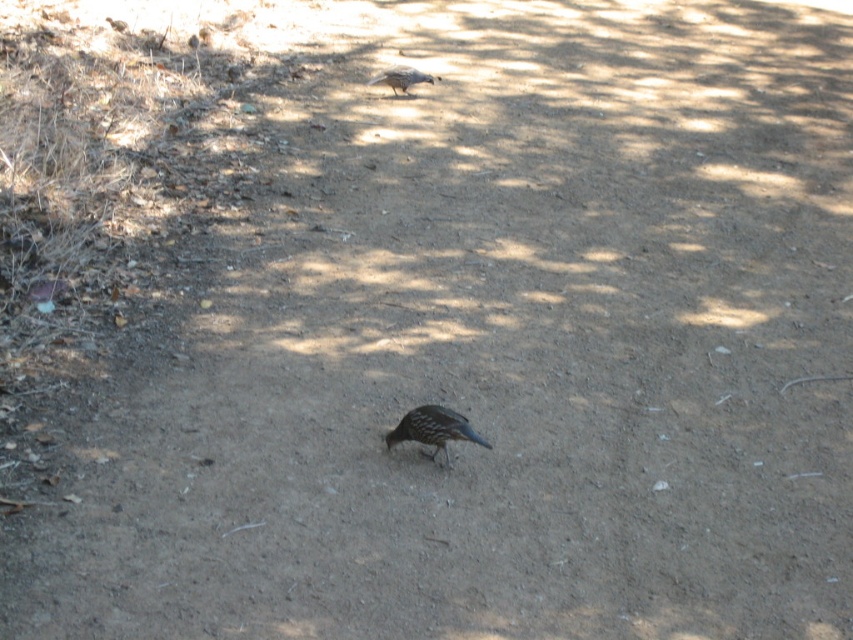
You are a nature photographer aiming to capture both the blue glossy bird at center and the brown speckled bird at upper center in a single frame. Based on their positions, which bird should you focus on first to ensure both are in the same shot?

The blue glossy bird at center is located below the brown speckled bird at upper center. To capture both in the same frame, you should focus on the brown speckled bird at upper center first, as it is higher up and will require adjusting the camera angle downward to include the lower positioned blue glossy bird at center.

You are standing at the starting point of the dirt path and want to reach the bird at point [401,88]. However, there is another bird at point [454,435] blocking your way. Can you walk around it without getting too close?

Point [454,435] is closer to the camera than point [401,88], so the bird at point [454,435] is in front of you. You can walk around it to reach the bird at point [401,88] without getting too close.